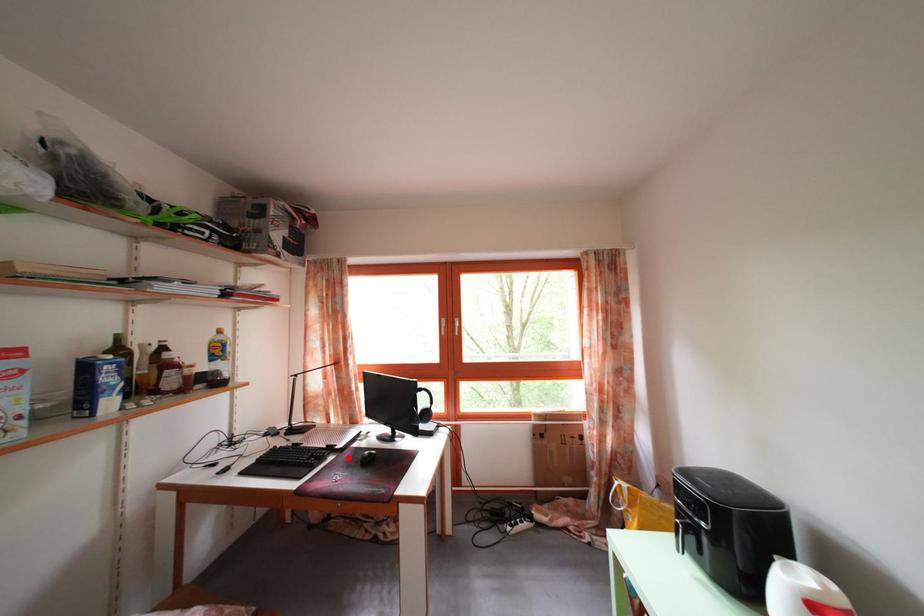
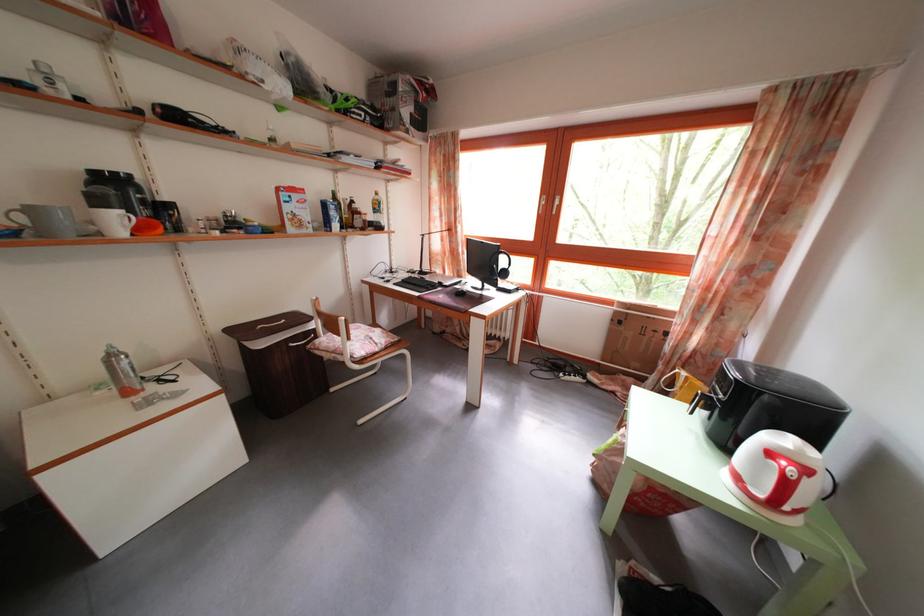
Question: I am providing you with two images of the same scene from different viewpoints. A red point is marked on the first image. Is the red point's position out of view in image 2?

Choices:
 (A) Yes
 (B) No

Answer: (B)